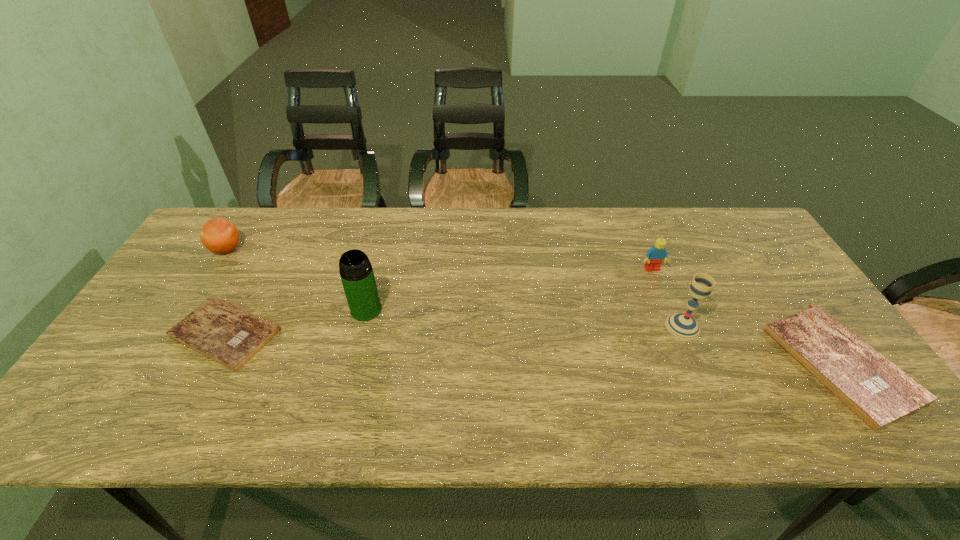
Where is `vacant region that satisfies the following two spatial constraints: 1. from the spout of the thermos bottle; 2. on the left side of the fifth shortest object`? vacant region that satisfies the following two spatial constraints: 1. from the spout of the thermos bottle; 2. on the left side of the fifth shortest object is located at coordinates (362, 326).

The image size is (960, 540). Find the location of `vacant region that satisfies the following two spatial constraints: 1. on the front side of the farthest object; 2. on the right side of the left Bible`. vacant region that satisfies the following two spatial constraints: 1. on the front side of the farthest object; 2. on the right side of the left Bible is located at coordinates click(173, 334).

The height and width of the screenshot is (540, 960). What are the coordinates of `vacant position in the image that satisfies the following two spatial constraints: 1. from the spout of the fourth object from right to left; 2. on the left side of the chalice` in the screenshot? It's located at (362, 326).

Find the location of `free spot that satisfies the following two spatial constraints: 1. on the face of the right Bible; 2. on the left side of the Lego`. free spot that satisfies the following two spatial constraints: 1. on the face of the right Bible; 2. on the left side of the Lego is located at coordinates (690, 363).